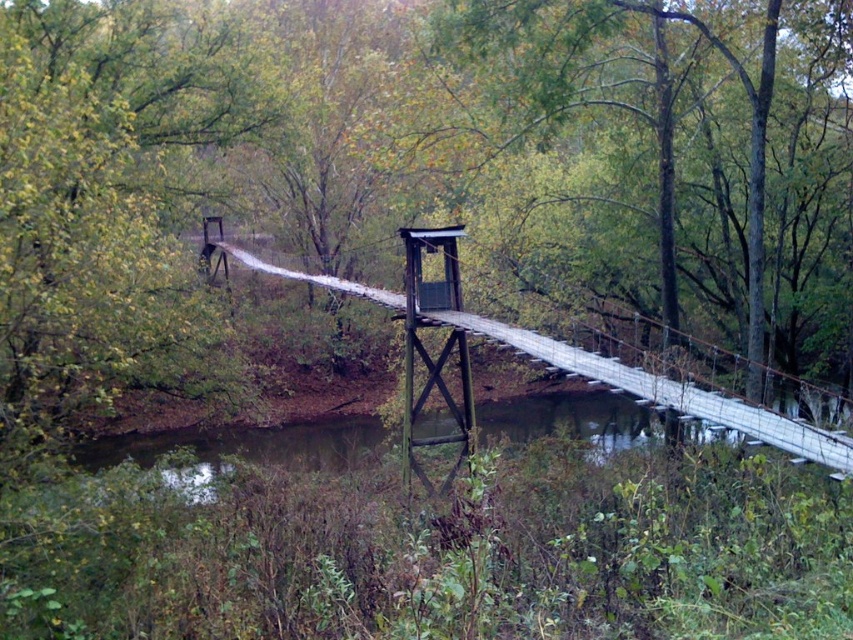
Question: Can you confirm if green leafy tree at center is positioned above wooden suspension bridge at center?

Choices:
 (A) yes
 (B) no

Answer: (A)

Question: In this image, where is green leafy tree at center located relative to wooden suspension bridge at center?

Choices:
 (A) above
 (B) below

Answer: (A)

Question: Does green leafy tree at center have a greater width compared to wooden suspension bridge at center?

Choices:
 (A) no
 (B) yes

Answer: (A)

Question: Among these points, which one is farthest from the camera?

Choices:
 (A) (654, 112)
 (B) (663, 397)

Answer: (A)

Question: Which point is closer to the camera?

Choices:
 (A) (674, 13)
 (B) (438, 384)

Answer: (A)